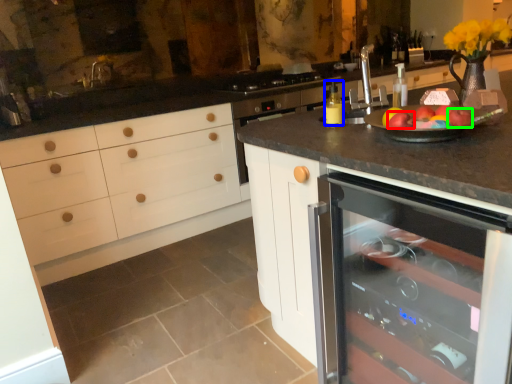
Question: Based on their relative distances, which object is farther from apple (highlighted by a red box)? Choose from bottle (highlighted by a blue box) and apple (highlighted by a green box).

Choices:
 (A) bottle
 (B) apple

Answer: (A)